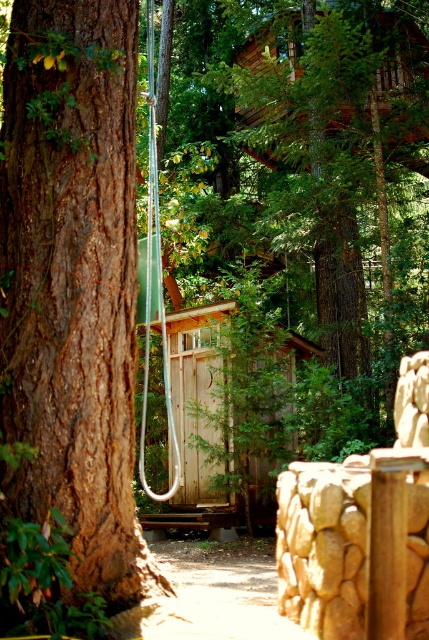
Is smooth brown tree trunk at center wider than weathered wood cabin at center?

Incorrect, smooth brown tree trunk at center's width does not surpass weathered wood cabin at center's.

Between smooth brown tree trunk at center and weathered wood cabin at center, which one appears on the left side from the viewer's perspective?

weathered wood cabin at center is more to the left.

Does point (384, 404) come farther from viewer compared to point (181, 440)?

That is False.

Locate an element on the screen. The image size is (429, 640). smooth brown tree trunk at center is located at coordinates (346, 168).

The width and height of the screenshot is (429, 640). What are the coordinates of `brown rough bark tree at left` in the screenshot? It's located at (73, 289).

Which of these two, brown rough bark tree at left or weathered wood cabin at center, stands taller?

Standing taller between the two is brown rough bark tree at left.

Does point (69, 209) lie behind point (262, 468)?

No, (69, 209) is in front of (262, 468).

Find the location of `brown rough bark tree at left`. brown rough bark tree at left is located at coordinates (73, 289).

Is point (6, 371) closer to camera compared to point (265, 61)?

Yes.

I want to click on brown rough bark tree at left, so click(73, 289).

In order to click on brown rough bark tree at left in this screenshot , I will do `click(73, 289)`.

I want to click on brown rough bark tree at left, so click(73, 289).